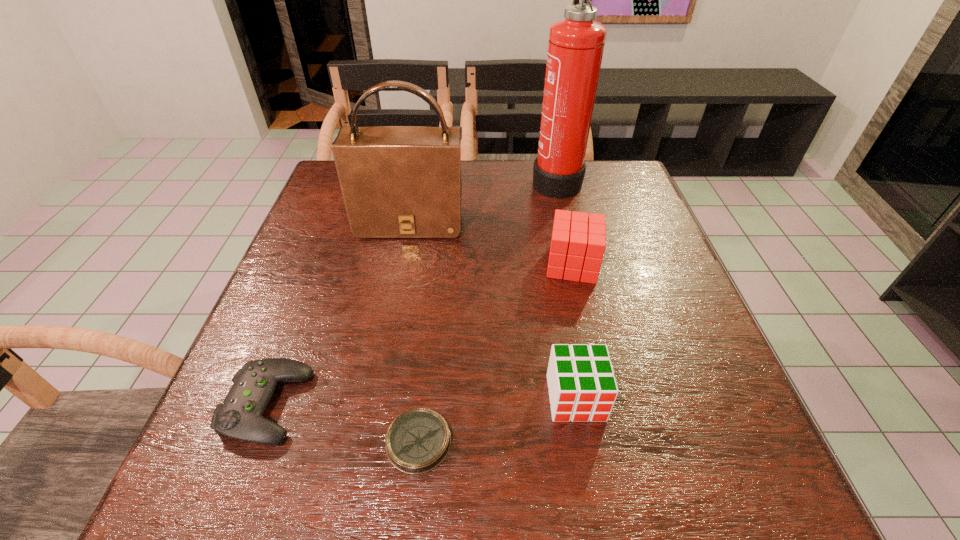
The width and height of the screenshot is (960, 540). In order to click on vacant space that is in between the control and the compass in this screenshot , I will do [343, 424].

Find the location of a particular element. The image size is (960, 540). empty space between the third farthest object and the shorter cube is located at coordinates (574, 331).

I want to click on vacant area that lies between the shortest object and the fire extinguisher, so click(488, 311).

At what (x,y) coordinates should I click in order to perform the action: click on unoccupied area between the compass and the fifth tallest object. Please return your answer as a coordinate pair (x, y). Looking at the image, I should click on (343, 424).

This screenshot has width=960, height=540. I want to click on free space between the tallest object and the shorter cube, so click(565, 289).

Locate an element on the screen. The height and width of the screenshot is (540, 960). free space between the farthest object and the shortest object is located at coordinates (488, 311).

Identify the location of blank region between the nearer cube and the compass. The image size is (960, 540). (497, 420).

This screenshot has width=960, height=540. In order to click on blank region between the tallest object and the fifth shortest object in this screenshot , I will do `click(483, 202)`.

Locate an element on the screen. The width and height of the screenshot is (960, 540). object that can be found as the fourth closest to the fourth tallest object is located at coordinates (240, 417).

Locate which object is the fourth closest to the taller cube. Please provide its 2D coordinates. Your answer should be formatted as a tuple, i.e. [(x, y)], where the tuple contains the x and y coordinates of a point satisfying the conditions above.

[(418, 440)]